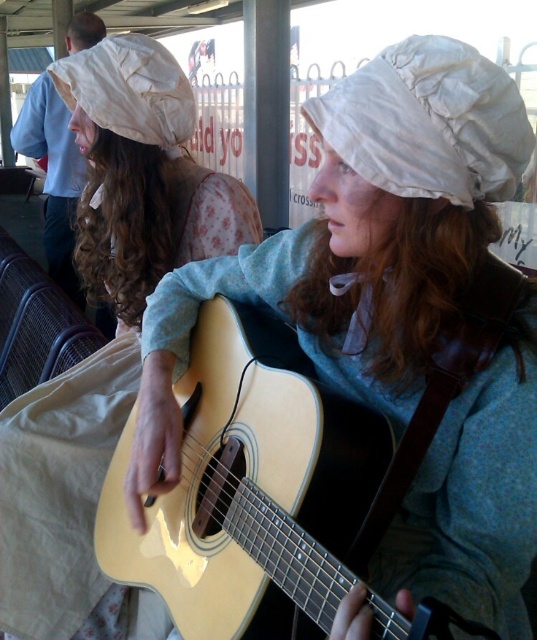
Question: Among these objects, which one is farthest from the camera?

Choices:
 (A) light wood acoustic guitar at center
 (B) white fabric hat at upper left
 (C) matte white hat at upper center

Answer: (B)

Question: Does white puffy hat at upper center appear over white fabric hat at upper left?

Choices:
 (A) yes
 (B) no

Answer: (B)

Question: Can you confirm if matte white hat at upper center is positioned to the right of white puffy hat at upper center?

Choices:
 (A) yes
 (B) no

Answer: (B)

Question: Which point is closer to the camera taking this photo?

Choices:
 (A) (410, 381)
 (B) (64, 611)

Answer: (A)

Question: Among these points, which one is farthest from the camera?

Choices:
 (A) (447, 180)
 (B) (342, 227)
 (C) (154, 120)

Answer: (C)

Question: Does matte white hat at upper center come in front of white puffy hat at upper center?

Choices:
 (A) yes
 (B) no

Answer: (B)